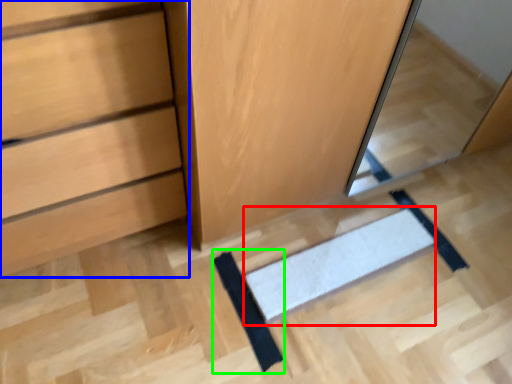
Question: Which object is positioned farthest from doormat (highlighted by a red box)? Select from chest of drawers (highlighted by a blue box) and doormat (highlighted by a green box).

Choices:
 (A) chest of drawers
 (B) doormat

Answer: (A)